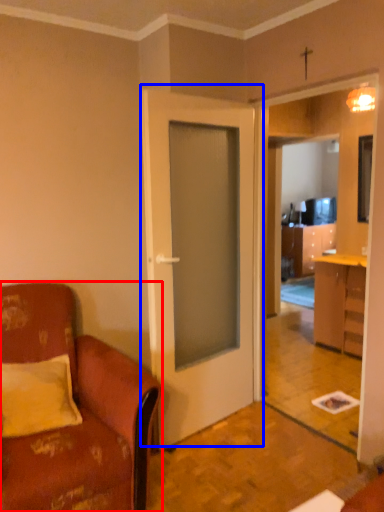
Question: Which point is closer to the camera, chair (highlighted by a red box) or door (highlighted by a blue box)?

Choices:
 (A) chair
 (B) door

Answer: (A)